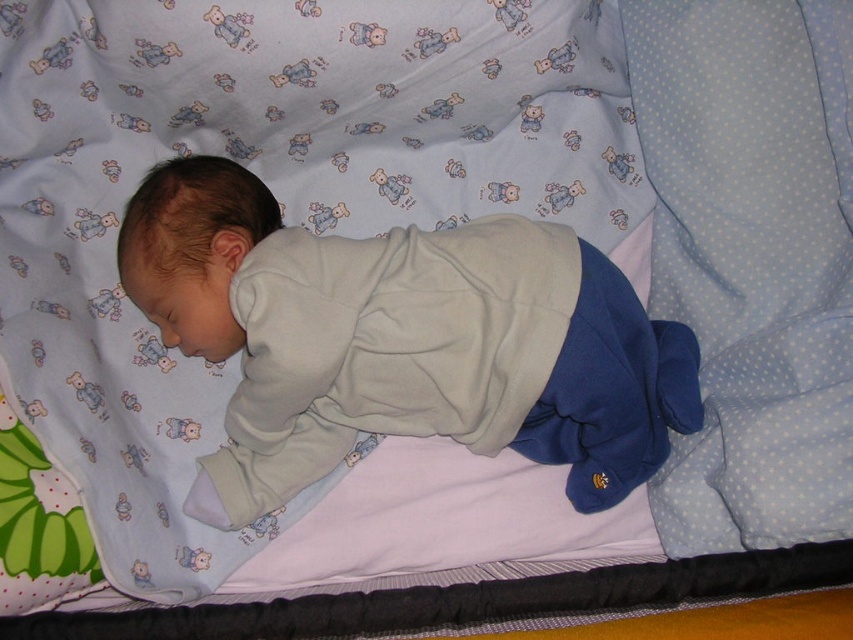
Question: Which object appears farthest from the camera in this image?

Choices:
 (A) light blue dotted pillow at right
 (B) light gray fleece baby at center

Answer: (B)

Question: Can you confirm if light gray fleece baby at center is smaller than light blue dotted pillow at right?

Choices:
 (A) no
 (B) yes

Answer: (A)

Question: Can you confirm if light gray fleece baby at center is bigger than light blue dotted pillow at right?

Choices:
 (A) yes
 (B) no

Answer: (A)

Question: In this image, where is light gray fleece baby at center located relative to light blue dotted pillow at right?

Choices:
 (A) left
 (B) right

Answer: (A)

Question: Which object appears closest to the camera in this image?

Choices:
 (A) light blue dotted pillow at right
 (B) light gray fleece baby at center

Answer: (A)